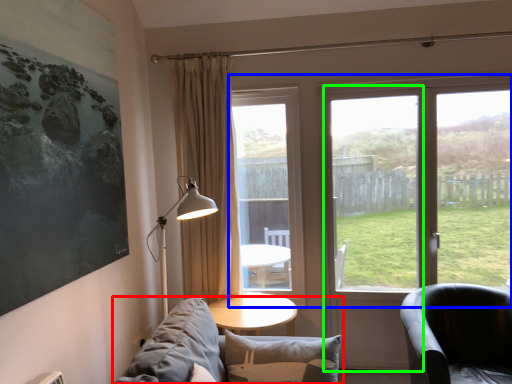
Question: Estimate the real-world distances between objects in this image. Which object is farther from studio couch (highlighted by a red box), window (highlighted by a blue box) or screen door (highlighted by a green box)?

Choices:
 (A) window
 (B) screen door

Answer: (A)